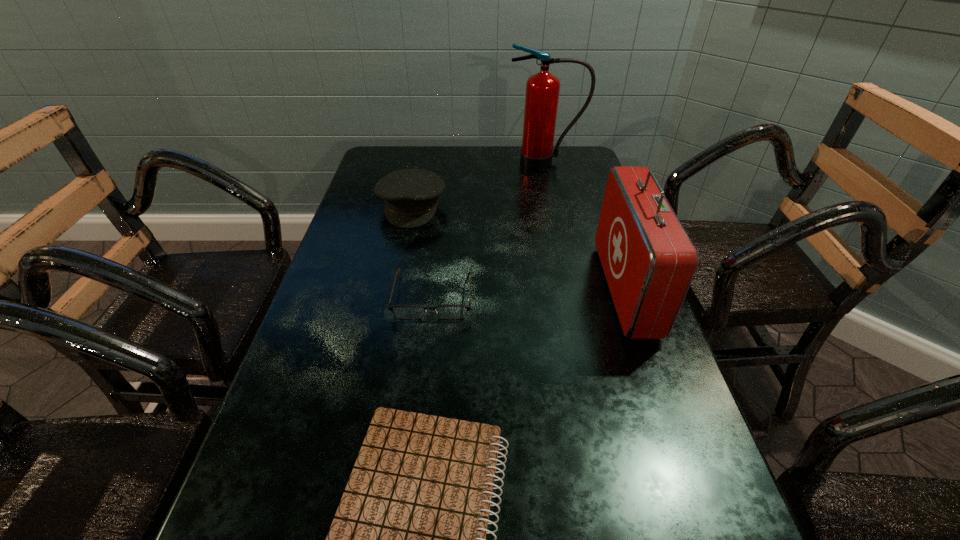
I want to click on free region at the far right corner of the desktop, so click(x=566, y=167).

At what (x,y) coordinates should I click in order to perform the action: click on empty space between the tallest object and the second tallest object. Please return your answer as a coordinate pair (x, y). Looking at the image, I should click on (585, 225).

You are a GUI agent. You are given a task and a screenshot of the screen. Output one action in this format:
    pyautogui.click(x=<x>, y=<y>)
    Task: Click on the vacant region between the beret and the second shortest object
    The width and height of the screenshot is (960, 540).
    Given the screenshot: What is the action you would take?
    pyautogui.click(x=422, y=251)

You are a GUI agent. You are given a task and a screenshot of the screen. Output one action in this format:
    pyautogui.click(x=<x>, y=<y>)
    Task: Click on the vacant point located between the third tallest object and the second shortest object
    This screenshot has height=540, width=960.
    Given the screenshot: What is the action you would take?
    pyautogui.click(x=422, y=251)

Locate an element on the screen. vacant point located between the first-aid kit and the third tallest object is located at coordinates (518, 248).

You are a GUI agent. You are given a task and a screenshot of the screen. Output one action in this format:
    pyautogui.click(x=<x>, y=<y>)
    Task: Click on the blank region between the tallest object and the first-aid kit
    This screenshot has height=540, width=960.
    Given the screenshot: What is the action you would take?
    pyautogui.click(x=585, y=225)

This screenshot has width=960, height=540. Find the location of `free point between the spectacles and the fire extinguisher`. free point between the spectacles and the fire extinguisher is located at coordinates (490, 228).

The width and height of the screenshot is (960, 540). I want to click on unoccupied area between the tallest object and the second shortest object, so click(x=490, y=228).

The image size is (960, 540). Identify the location of free space between the farthest object and the third tallest object. (478, 184).

You are a GUI agent. You are given a task and a screenshot of the screen. Output one action in this format:
    pyautogui.click(x=<x>, y=<y>)
    Task: Click on the free space between the beret and the farthest object
    This screenshot has width=960, height=540.
    Given the screenshot: What is the action you would take?
    pyautogui.click(x=478, y=184)